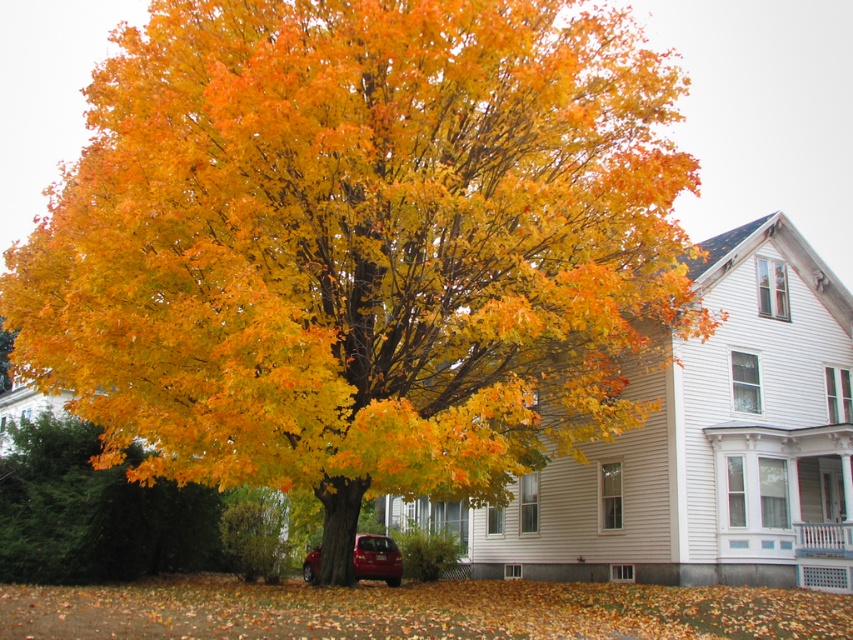
Question: Does golden yellow leaves at lower left appear over shiny red sedan at lower center?

Choices:
 (A) no
 (B) yes

Answer: (B)

Question: Which point is farther to the camera?

Choices:
 (A) (366, 548)
 (B) (39, 554)

Answer: (A)

Question: Is golden yellow leaves at lower left thinner than shiny red sedan at lower center?

Choices:
 (A) yes
 (B) no

Answer: (B)

Question: Which point is closer to the camera?

Choices:
 (A) (74, 509)
 (B) (355, 561)

Answer: (A)

Question: Is the position of golden yellow leaves at lower left more distant than that of shiny red sedan at lower center?

Choices:
 (A) no
 (B) yes

Answer: (A)